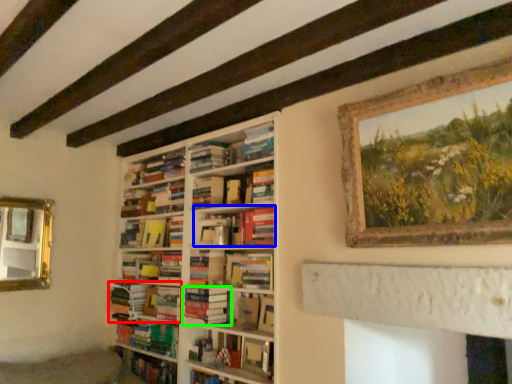
Question: Estimate the real-world distances between objects in this image. Which object is farther from book (highlighted by a red box), book (highlighted by a blue box) or book (highlighted by a green box)?

Choices:
 (A) book
 (B) book

Answer: (A)